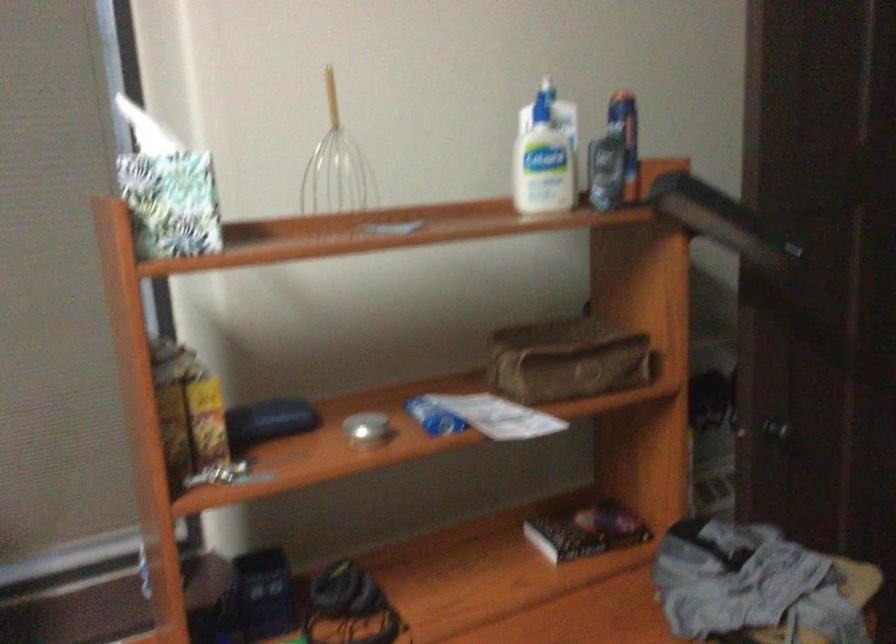
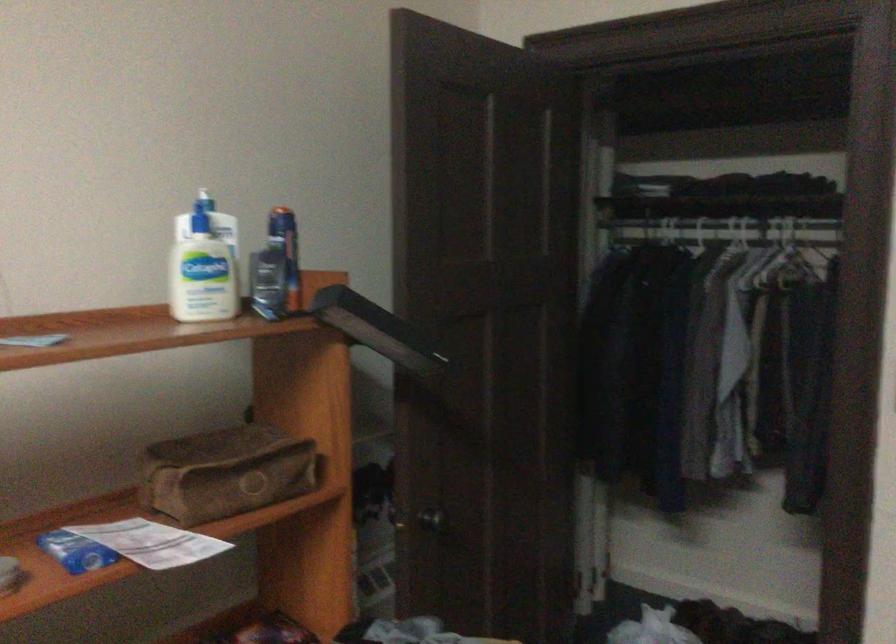
In the second image, find the point that corresponds to the point at 543,156 in the first image.

(203, 265)